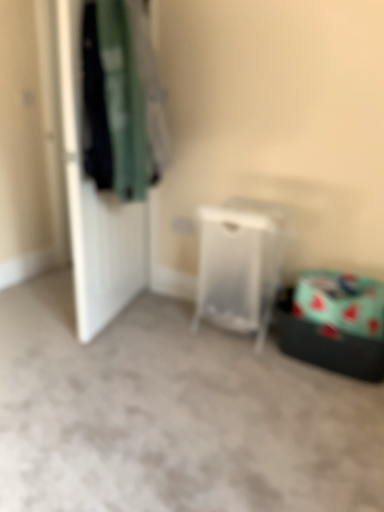
Question: Should I look upward or downward to see transparent plastic laundry basket at center?

Choices:
 (A) down
 (B) up

Answer: (A)

Question: Can you confirm if dark green fabric at left is bigger than transparent plastic laundry basket at center?

Choices:
 (A) no
 (B) yes

Answer: (B)

Question: From the image's perspective, is dark green fabric at left under transparent plastic laundry basket at center?

Choices:
 (A) no
 (B) yes

Answer: (A)

Question: Is dark green fabric at left directly adjacent to transparent plastic laundry basket at center?

Choices:
 (A) yes
 (B) no

Answer: (B)

Question: Is dark green fabric at left looking in the opposite direction of transparent plastic laundry basket at center?

Choices:
 (A) yes
 (B) no

Answer: (B)

Question: Is dark green fabric at left not near transparent plastic laundry basket at center?

Choices:
 (A) no
 (B) yes

Answer: (A)

Question: Considering the relative positions of dark green fabric at left and transparent plastic laundry basket at center in the image provided, is dark green fabric at left behind transparent plastic laundry basket at center?

Choices:
 (A) yes
 (B) no

Answer: (B)

Question: Is dark green fabric at left aimed at white matte door at left?

Choices:
 (A) no
 (B) yes

Answer: (A)

Question: From the image's perspective, would you say dark green fabric at left is positioned over white matte door at left?

Choices:
 (A) yes
 (B) no

Answer: (A)

Question: Does dark green fabric at left have a greater height compared to white matte door at left?

Choices:
 (A) yes
 (B) no

Answer: (B)

Question: Is there a large distance between dark green fabric at left and white matte door at left?

Choices:
 (A) yes
 (B) no

Answer: (B)

Question: Is dark green fabric at left with white matte door at left?

Choices:
 (A) yes
 (B) no

Answer: (B)

Question: From the image's perspective, would you say dark green fabric at left is shown under white matte door at left?

Choices:
 (A) yes
 (B) no

Answer: (B)

Question: Could transparent plastic laundry basket at center be considered to be inside white matte door at left?

Choices:
 (A) no
 (B) yes

Answer: (A)